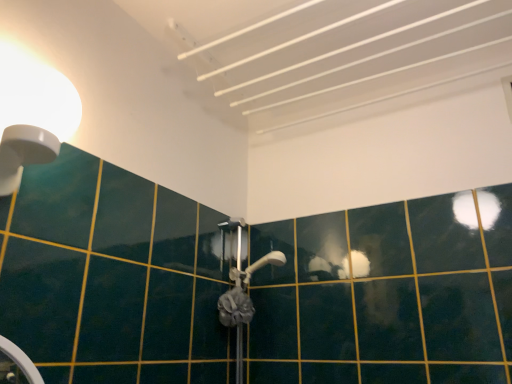
Question: Does gray fabric shower at center have a smaller size compared to white glossy light fixture at upper left?

Choices:
 (A) yes
 (B) no

Answer: (A)

Question: From a real-world perspective, is gray fabric shower at center on white glossy light fixture at upper left?

Choices:
 (A) yes
 (B) no

Answer: (B)

Question: From a real-world perspective, is gray fabric shower at center under white glossy light fixture at upper left?

Choices:
 (A) no
 (B) yes

Answer: (B)

Question: Is gray fabric shower at center aimed at white glossy light fixture at upper left?

Choices:
 (A) yes
 (B) no

Answer: (B)

Question: From the image's perspective, is gray fabric shower at center located beneath white glossy light fixture at upper left?

Choices:
 (A) no
 (B) yes

Answer: (B)

Question: Is gray fabric shower at center beside white glossy light fixture at upper left?

Choices:
 (A) no
 (B) yes

Answer: (A)

Question: Could you tell me if white glossy light fixture at upper left is facing gray fabric shower at center?

Choices:
 (A) no
 (B) yes

Answer: (A)

Question: From a real-world perspective, is white glossy light fixture at upper left beneath gray fabric shower at center?

Choices:
 (A) yes
 (B) no

Answer: (B)

Question: Is white glossy light fixture at upper left at the left side of gray fabric shower at center?

Choices:
 (A) yes
 (B) no

Answer: (A)

Question: Can you confirm if white glossy light fixture at upper left is thinner than gray fabric shower at center?

Choices:
 (A) yes
 (B) no

Answer: (B)

Question: Is white glossy light fixture at upper left outside of gray fabric shower at center?

Choices:
 (A) no
 (B) yes

Answer: (B)

Question: From a real-world perspective, is white glossy light fixture at upper left on top of gray fabric shower at center?

Choices:
 (A) yes
 (B) no

Answer: (A)

Question: Is gray fabric shower at center taller or shorter than white glossy light fixture at upper left?

Choices:
 (A) short
 (B) tall

Answer: (A)